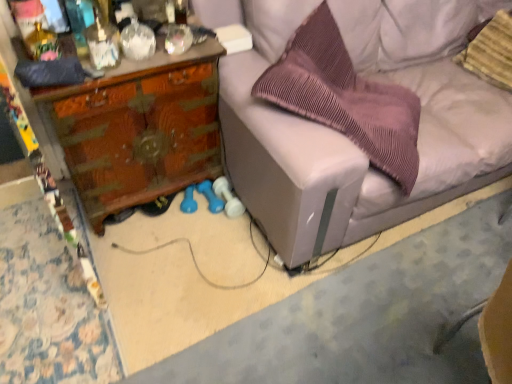
Identify the location of vacant area on top of wooden desk at left (from a real-world perspective). (128, 38).